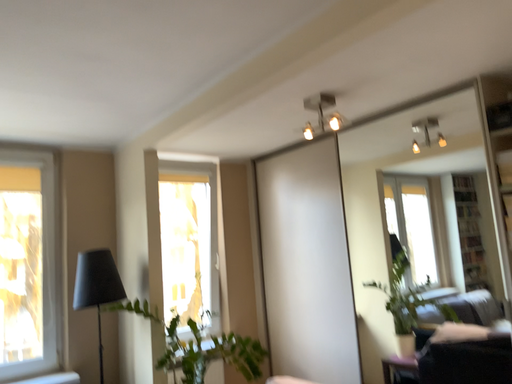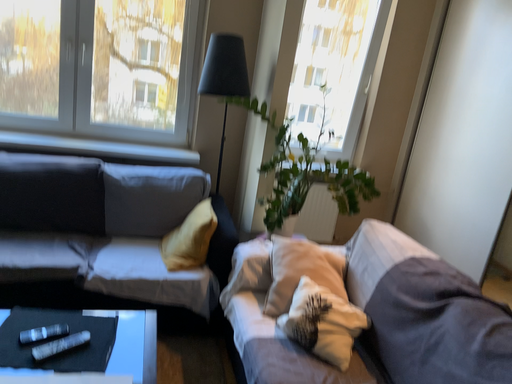
Question: How did the camera likely rotate when shooting the video?

Choices:
 (A) rotated right
 (B) rotated left

Answer: (B)